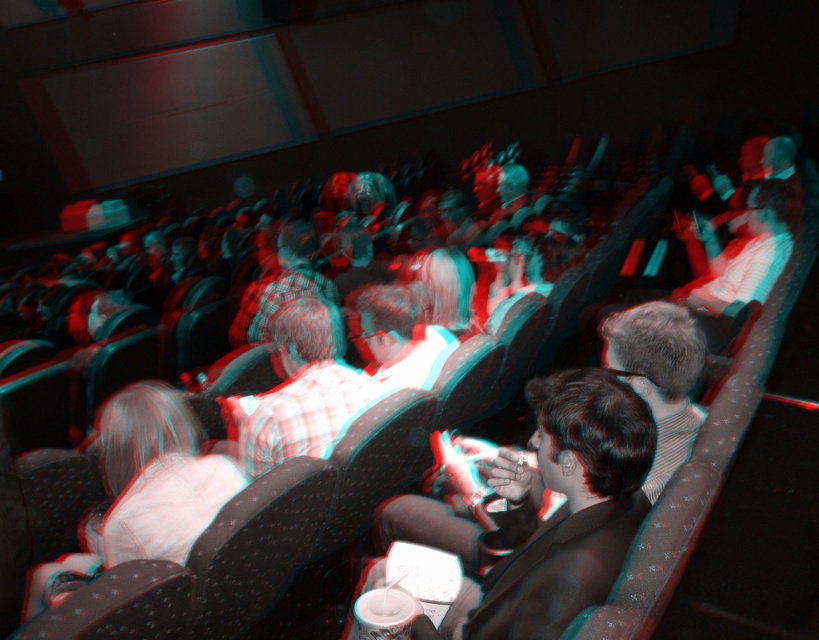
Question: Which object is farther from the camera taking this photo?

Choices:
 (A) matte black suit at center
 (B) plaid shirt at center

Answer: (B)

Question: Which point is farther to the camera?

Choices:
 (A) plaid shirt at center
 (B) matte black suit at center

Answer: (A)

Question: Does matte black suit at center have a lesser width compared to plaid shirt at center?

Choices:
 (A) no
 (B) yes

Answer: (A)

Question: Does matte black suit at center have a lesser width compared to plaid shirt at center?

Choices:
 (A) no
 (B) yes

Answer: (A)

Question: Does matte black suit at center have a smaller size compared to plaid shirt at center?

Choices:
 (A) no
 (B) yes

Answer: (A)

Question: Which point appears closest to the camera in this image?

Choices:
 (A) (555, 515)
 (B) (213, 474)

Answer: (A)